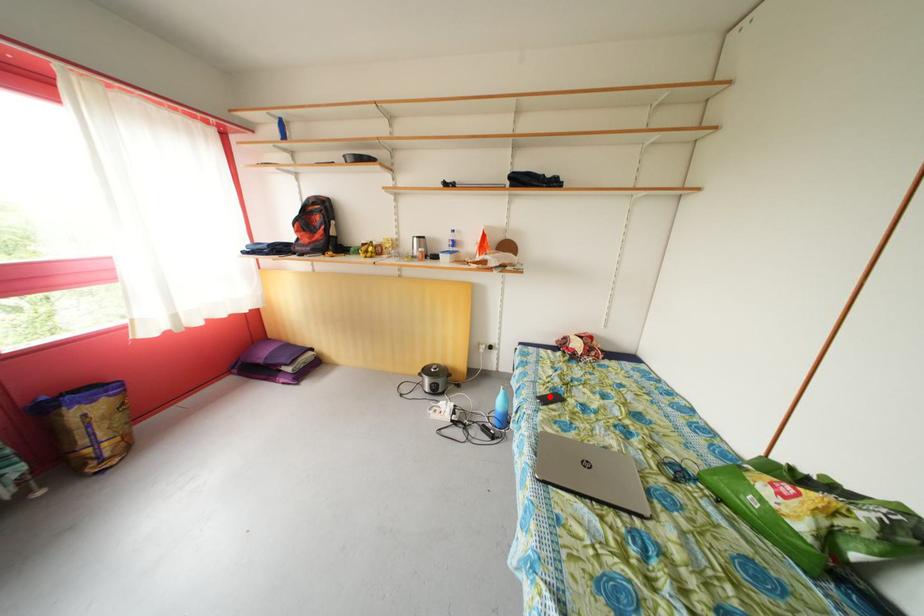
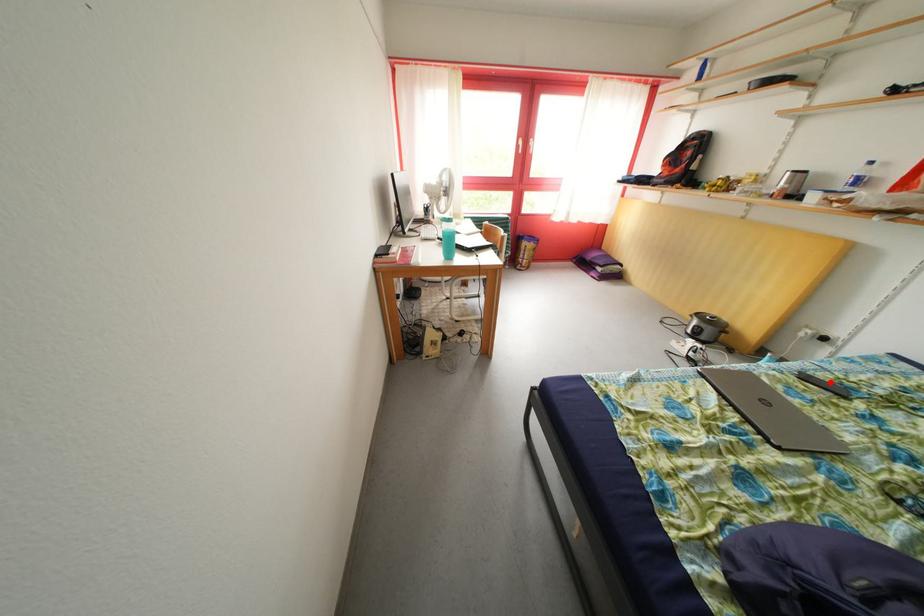
I am providing you with two images of the same scene from different viewpoints. A red point is marked on the first image and another point is marked on the second image. Are the points marked in image1 and image2 representing the same 3D position?

Yes